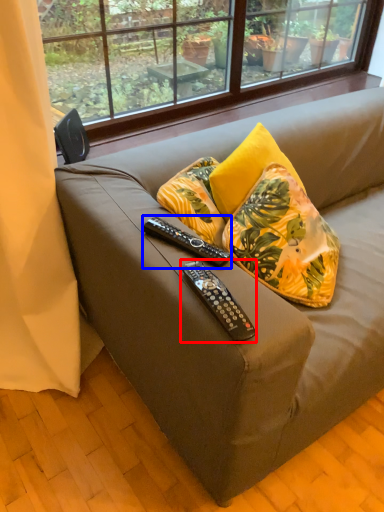
Question: Which point is further to the camera, remote control (highlighted by a red box) or remote control (highlighted by a blue box)?

Choices:
 (A) remote control
 (B) remote control

Answer: (B)